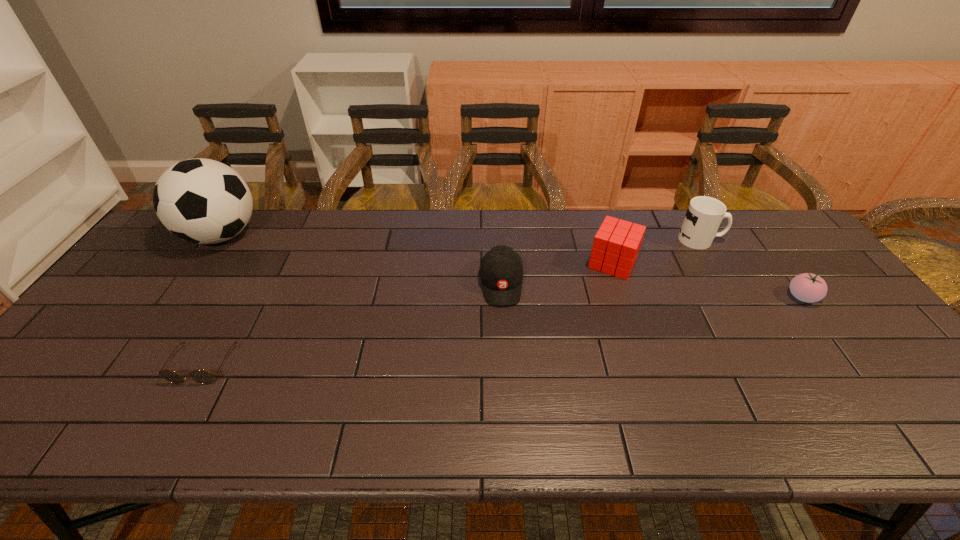
Where is `vacant area in the image that satisfies the following two spatial constraints: 1. on the handle side of the second object from right to left; 2. with a logo on the front of the baseball cap`? The image size is (960, 540). vacant area in the image that satisfies the following two spatial constraints: 1. on the handle side of the second object from right to left; 2. with a logo on the front of the baseball cap is located at coordinates [x=726, y=284].